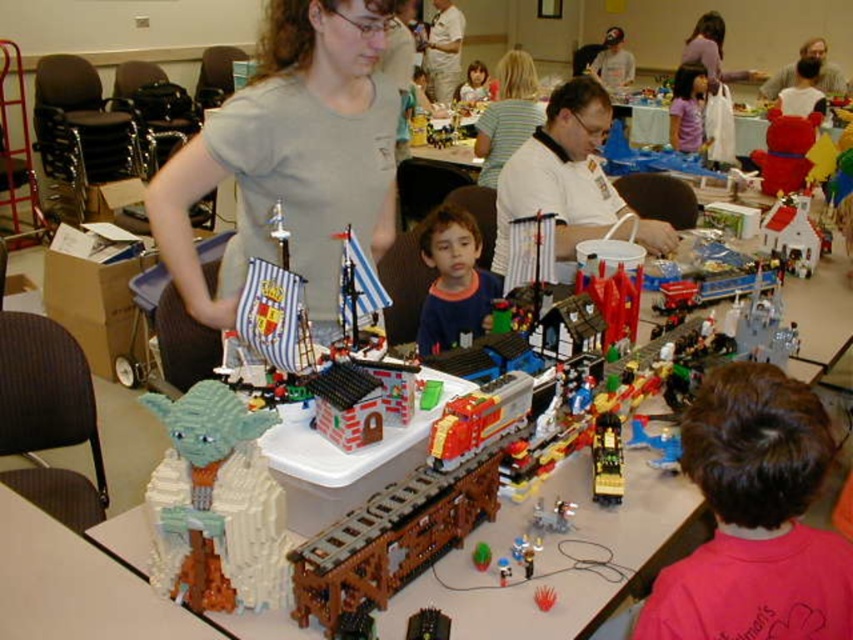
Does point (782, 608) come farther from viewer compared to point (521, 90)?

That is False.

Does brown hair at lower right have a larger size compared to striped fabric shirt at center?

Incorrect, brown hair at lower right is not larger than striped fabric shirt at center.

Is point (764, 472) closer to viewer compared to point (526, 131)?

Yes, point (764, 472) is in front of point (526, 131).

Locate an element on the screen. The height and width of the screenshot is (640, 853). brown hair at lower right is located at coordinates (753, 516).

Which is in front, point (389, 28) or point (706, 90)?

Point (389, 28)

Is gray matte shirt at center to the left of smooth pink shirt at upper center from the viewer's perspective?

Yes, gray matte shirt at center is to the left of smooth pink shirt at upper center.

Who is more forward, (230, 260) or (671, 109)?

Point (230, 260)

What are the coordinates of `gray matte shirt at center` in the screenshot? It's located at (291, 157).

The height and width of the screenshot is (640, 853). Describe the element at coordinates (453, 282) in the screenshot. I see `blue cotton shirt at center` at that location.

Is blue cotton shirt at center shorter than smooth pink shirt at upper center?

Indeed, blue cotton shirt at center has a lesser height compared to smooth pink shirt at upper center.

Where is `blue cotton shirt at center`? blue cotton shirt at center is located at coordinates (453, 282).